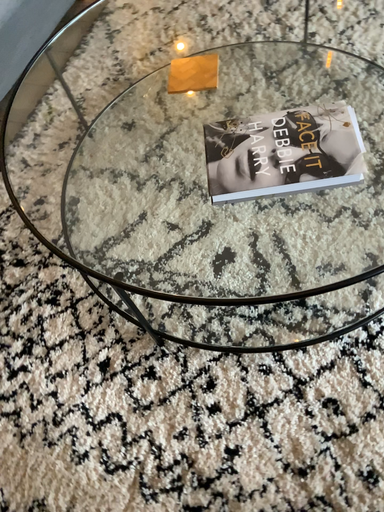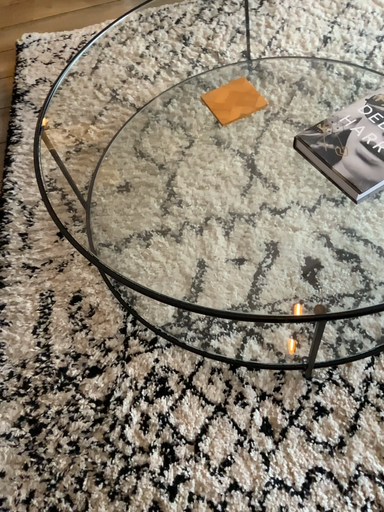
Question: Which way did the camera rotate in the video?

Choices:
 (A) rotated left
 (B) rotated right

Answer: (B)